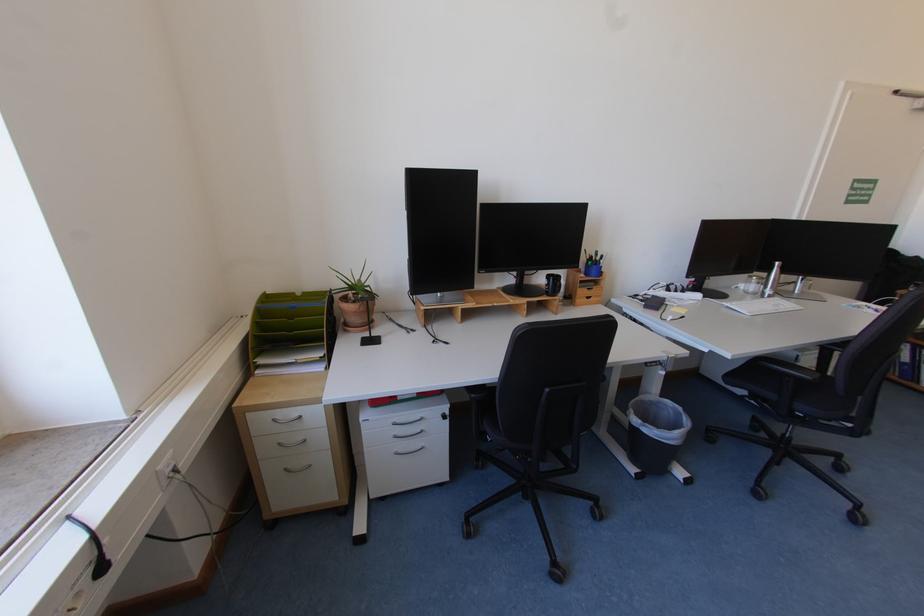
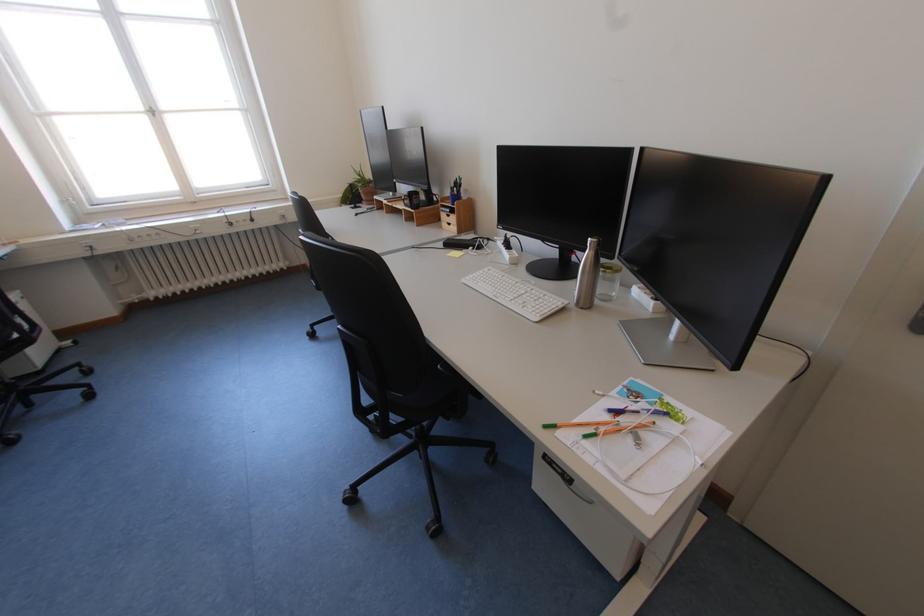
Locate, in the second image, the point that corresponds to the point at 784,264 in the first image.

(599, 240)